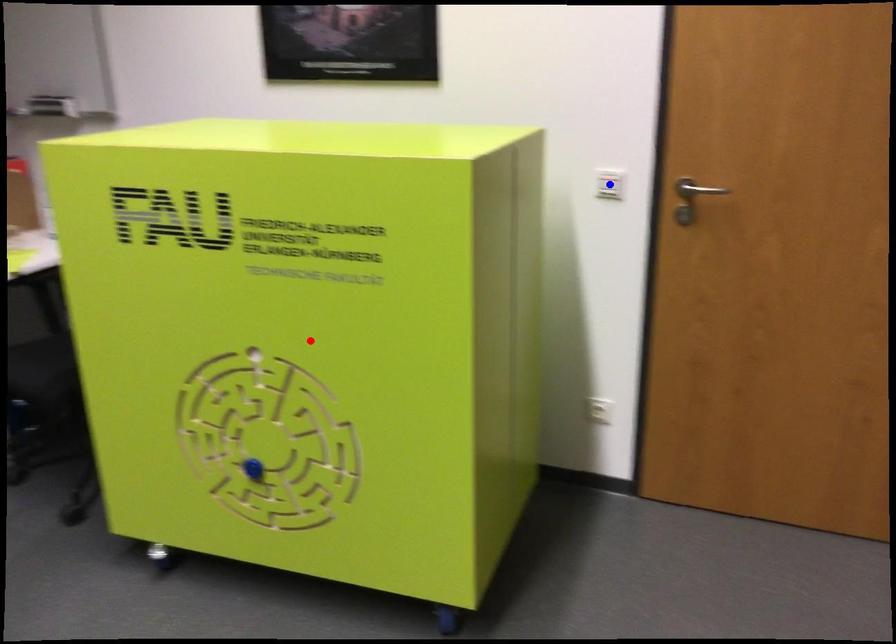
Question: Which of the two points in the image is closer to the camera?

Choices:
 (A) Blue point is closer.
 (B) Red point is closer.

Answer: (B)